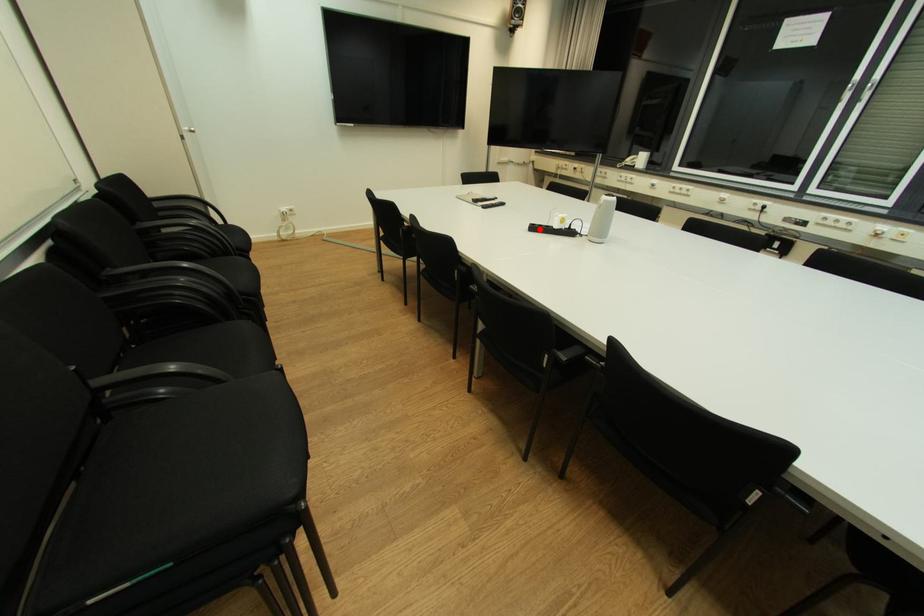
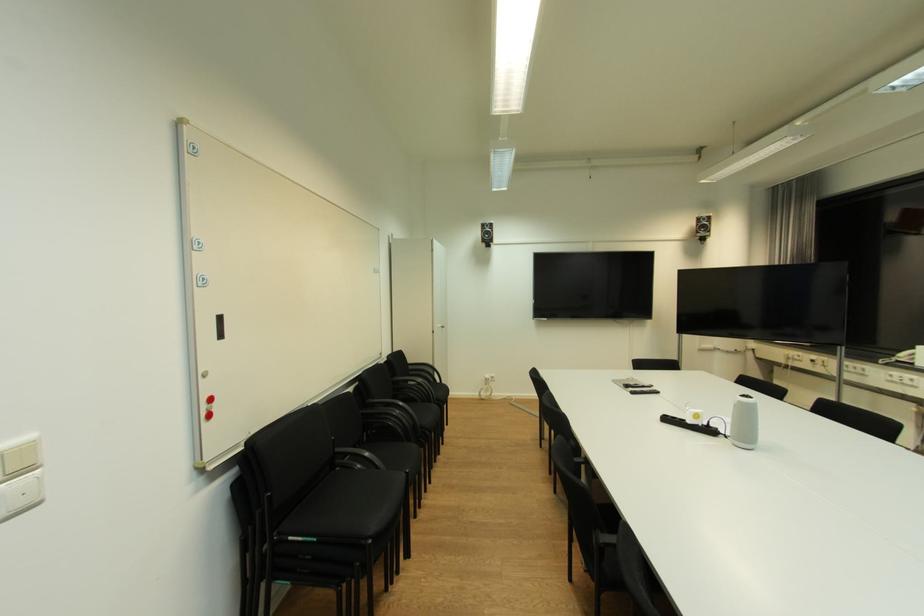
Locate, in the second image, the point that corresponds to the highlighted location in the first image.

(674, 421)